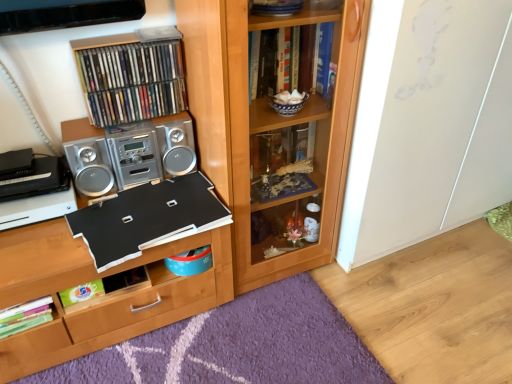
Question: Is black matte board at center, which is counted as the 1th book, starting from the bottom, far from black matte board at center?

Choices:
 (A) yes
 (B) no

Answer: (B)

Question: From the image's perspective, is black matte board at center, which is counted as the 1th book, starting from the bottom, above black matte board at center?

Choices:
 (A) yes
 (B) no

Answer: (A)

Question: Can you confirm if black matte board at center, which is the third book in top-to-bottom order, is smaller than black matte board at center?

Choices:
 (A) no
 (B) yes

Answer: (B)

Question: Is black matte board at center, which is counted as the 1th book, starting from the bottom, oriented towards black matte board at center?

Choices:
 (A) yes
 (B) no

Answer: (B)

Question: Does black matte board at center, which is the third book in top-to-bottom order, have a lesser height compared to black matte board at center?

Choices:
 (A) yes
 (B) no

Answer: (A)

Question: In terms of width, does metallic cd case at upper left, which appears as the 3th book when ordered from the bottom, look wider or thinner when compared to black matte board at center?

Choices:
 (A) thin
 (B) wide

Answer: (A)

Question: Considering the positions of metallic cd case at upper left, which appears as the 3th book when ordered from the bottom, and black matte board at center in the image, is metallic cd case at upper left, which appears as the 3th book when ordered from the bottom, bigger or smaller than black matte board at center?

Choices:
 (A) big
 (B) small

Answer: (B)

Question: From a real-world perspective, is metallic cd case at upper left, which appears as the 3th book when ordered from the bottom, positioned above or below black matte board at center?

Choices:
 (A) above
 (B) below

Answer: (A)

Question: From the image's perspective, is metallic cd case at upper left, which appears as the 3th book when ordered from the bottom, above or below black matte board at center?

Choices:
 (A) above
 (B) below

Answer: (A)

Question: Would you say black matte board at center, which is counted as the 1th book, starting from the bottom, is to the left or to the right of wooden bookcase at center in the picture?

Choices:
 (A) left
 (B) right

Answer: (A)

Question: From a real-world perspective, is black matte board at center, which is counted as the 1th book, starting from the bottom, positioned above or below wooden bookcase at center?

Choices:
 (A) above
 (B) below

Answer: (B)

Question: Looking at their shapes, would you say black matte board at center, which is counted as the 1th book, starting from the bottom, is wider or thinner than wooden bookcase at center?

Choices:
 (A) thin
 (B) wide

Answer: (A)

Question: Based on their sizes in the image, would you say black matte board at center, which is counted as the 1th book, starting from the bottom, is bigger or smaller than wooden bookcase at center?

Choices:
 (A) small
 (B) big

Answer: (A)

Question: From a real-world perspective, is purple shaggy rug at lower center physically located above or below black matte board at center, which is the third book in top-to-bottom order?

Choices:
 (A) below
 (B) above

Answer: (A)

Question: Is purple shaggy rug at lower center inside or outside of black matte board at center, which is the third book in top-to-bottom order?

Choices:
 (A) outside
 (B) inside

Answer: (A)